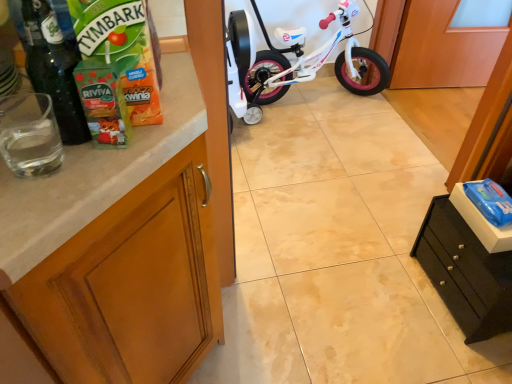
Question: From the image's perspective, would you say wooden cabinet at left, which is the second cabinetry in right-to-left order, is shown under white glossy bicycle at center?

Choices:
 (A) yes
 (B) no

Answer: (A)

Question: Would you say wooden cabinet at left, marked as the first cabinetry in a left-to-right arrangement, contains white glossy bicycle at center?

Choices:
 (A) yes
 (B) no

Answer: (B)

Question: Is wooden cabinet at left, which is the second cabinetry in right-to-left order, not close to white glossy bicycle at center?

Choices:
 (A) yes
 (B) no

Answer: (A)

Question: Is wooden cabinet at left, which is the second cabinetry in right-to-left order, closer to camera compared to white glossy bicycle at center?

Choices:
 (A) yes
 (B) no

Answer: (A)

Question: From the image's perspective, would you say wooden cabinet at left, which is the second cabinetry in right-to-left order, is positioned over white glossy bicycle at center?

Choices:
 (A) no
 (B) yes

Answer: (A)

Question: Considering the relative sizes of wooden cabinet at left, marked as the first cabinetry in a left-to-right arrangement, and white glossy bicycle at center in the image provided, is wooden cabinet at left, marked as the first cabinetry in a left-to-right arrangement, bigger than white glossy bicycle at center?

Choices:
 (A) yes
 (B) no

Answer: (A)

Question: Is white glossy bicycle at center shorter than black matte drawer at lower right, the first cabinetry positioned from the right?

Choices:
 (A) yes
 (B) no

Answer: (B)

Question: Is white glossy bicycle at center bigger than black matte drawer at lower right, positioned as the second cabinetry in left-to-right order?

Choices:
 (A) yes
 (B) no

Answer: (A)

Question: Considering the relative sizes of white glossy bicycle at center and black matte drawer at lower right, the first cabinetry positioned from the right, in the image provided, is white glossy bicycle at center wider than black matte drawer at lower right, the first cabinetry positioned from the right,?

Choices:
 (A) no
 (B) yes

Answer: (B)

Question: Is black matte drawer at lower right, the first cabinetry positioned from the right, inside white glossy bicycle at center?

Choices:
 (A) yes
 (B) no

Answer: (B)

Question: Is the position of white glossy bicycle at center less distant than that of black matte drawer at lower right, the first cabinetry positioned from the right?

Choices:
 (A) no
 (B) yes

Answer: (A)

Question: From a real-world perspective, is white glossy bicycle at center located higher than black matte drawer at lower right, positioned as the second cabinetry in left-to-right order?

Choices:
 (A) yes
 (B) no

Answer: (A)

Question: Are black matte drawer at lower right, positioned as the second cabinetry in left-to-right order, and wooden cabinet at left, marked as the first cabinetry in a left-to-right arrangement, located far from each other?

Choices:
 (A) no
 (B) yes

Answer: (A)